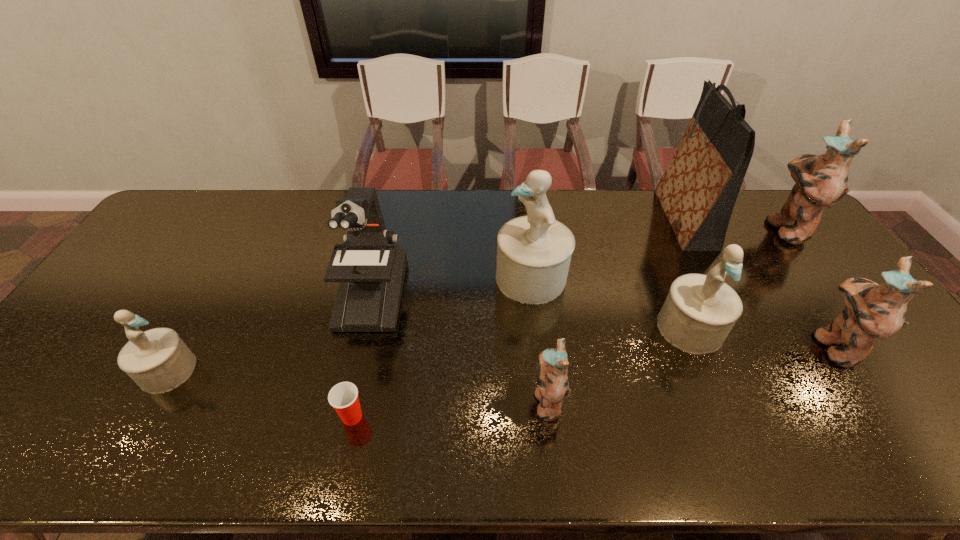
Find the location of a particular element. the nearest pink figurine is located at coordinates (552, 365).

The image size is (960, 540). Find the location of `the leftmost pink figurine`. the leftmost pink figurine is located at coordinates (552, 365).

Image resolution: width=960 pixels, height=540 pixels. In order to click on red Dixie cup in this screenshot , I will do `click(343, 397)`.

This screenshot has height=540, width=960. Find the location of `Dixie cup`. Dixie cup is located at coordinates (343, 397).

Find the location of a particular element. The height and width of the screenshot is (540, 960). vacant space located 0.230m on the front-facing side of the tallest object is located at coordinates (590, 219).

I want to click on vacant space located on the front-facing side of the tallest object, so click(x=634, y=219).

The height and width of the screenshot is (540, 960). Find the location of `free space located on the front-facing side of the tallest object`. free space located on the front-facing side of the tallest object is located at coordinates (549, 219).

You are a GUI agent. You are given a task and a screenshot of the screen. Output one action in this format:
    pyautogui.click(x=<x>, y=<y>)
    Task: Click on the free region located at the beak of the biggest white figurine
    This screenshot has width=960, height=540.
    Given the screenshot: What is the action you would take?
    pyautogui.click(x=393, y=278)

Identify the location of free space located 0.060m at the beak of the biggest white figurine. (475, 278).

Locate an element on the screen. The image size is (960, 540). free space located at the beak of the biggest white figurine is located at coordinates (466, 278).